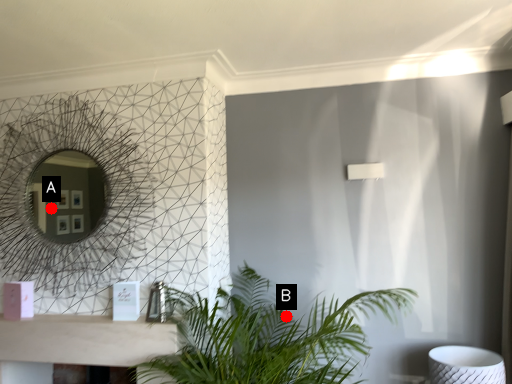
Question: Two points are circled on the image, labeled by A and B beside each circle. Which point is closer to the camera taking this photo?

Choices:
 (A) A is closer
 (B) B is closer

Answer: (B)